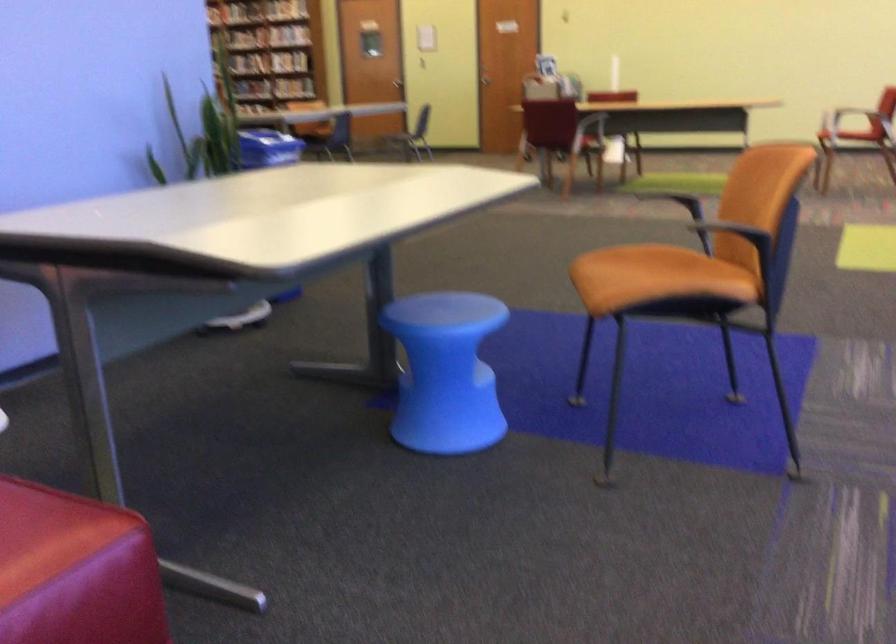
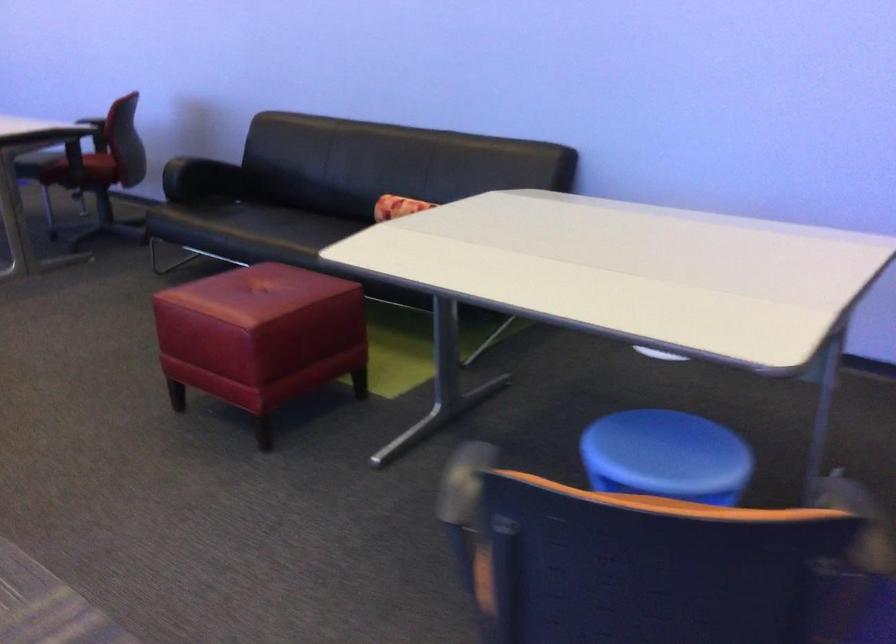
The point at (x=127, y=533) is marked in the first image. Where is the corresponding point in the second image?

(261, 337)